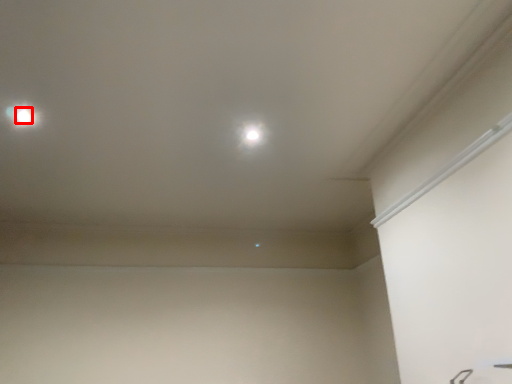
Question: From the image's perspective, what is the correct spatial positioning of dot (annotated by the red box) in reference to dot?

Choices:
 (A) below
 (B) above

Answer: (B)